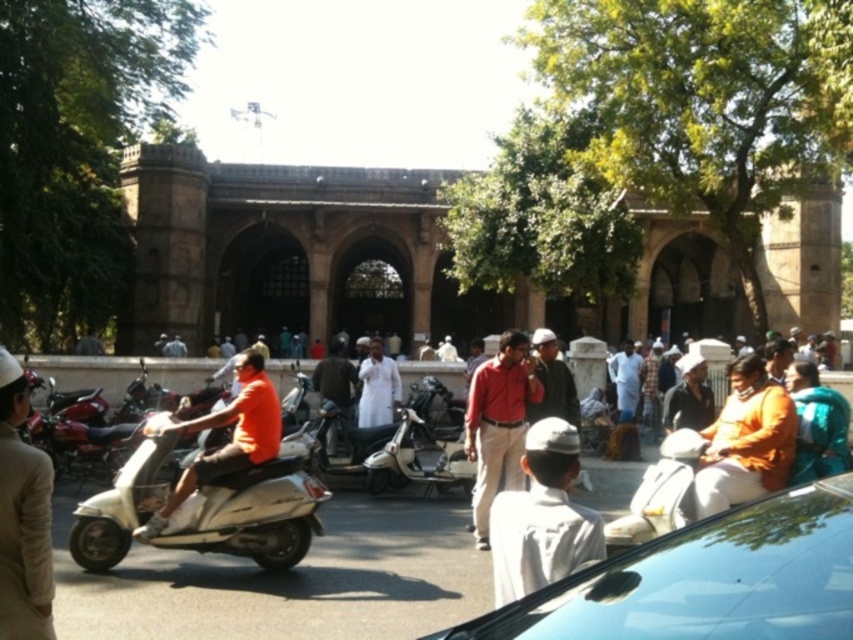
Looking at this image, you are standing in front of the historic building and want to take a photo that includes both point (479,460) and point (387,406). Based on their positions, which point will appear larger in your photo?

Point (479,460) is closer to the camera than point (387,406), so it will appear larger in the photo.

You are a photographer planning to take a group photo of the orange cotton shirt at right and the matte red shirt at center. If you want to ensure both shirts are fully visible in the frame, which shirt should you position closer to the camera to avoid cropping?

The orange cotton shirt at right has a larger width than the matte red shirt at center. To ensure both shirts are fully visible in the frame, position the orange cotton shirt at right closer to the camera since its larger size requires more space in the photo.